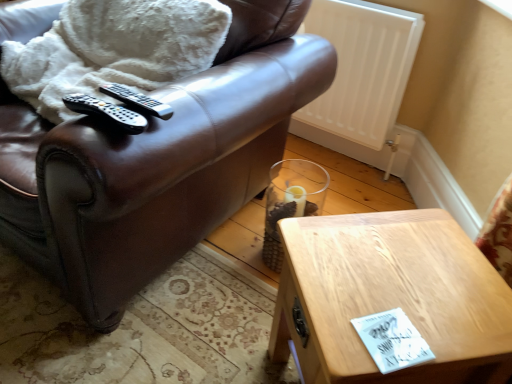
Measure the distance between point [130,263] and camera.

3.49 feet.

The image size is (512, 384). Describe the element at coordinates (291, 201) in the screenshot. I see `clear glass vase at lower center` at that location.

Image resolution: width=512 pixels, height=384 pixels. Describe the element at coordinates (106, 112) in the screenshot. I see `black plastic remote at center, which ranks as the 2th remote in back-to-front order` at that location.

Locate an element on the screen. wooden table at lower right is located at coordinates (390, 297).

Relative to black plastic remote at upper left, the second remote positioned from the front, is brown leather chair at upper left in front or behind?

Visually, brown leather chair at upper left is located in front of black plastic remote at upper left, the second remote positioned from the front.

Is brown leather chair at upper left taller or shorter than black plastic remote at upper left, the second remote positioned from the front?

Clearly, brown leather chair at upper left is taller compared to black plastic remote at upper left, the second remote positioned from the front.

Is point (53, 253) more distant than point (143, 105)?

Yes, it is.

Does white matte radiator at upper right appear on the left side of black plastic remote at upper left, which ranks as the first remote in back-to-front order?

No, white matte radiator at upper right is not to the left of black plastic remote at upper left, which ranks as the first remote in back-to-front order.

Is white matte radiator at upper right far from black plastic remote at upper left, which ranks as the first remote in back-to-front order?

Yes, white matte radiator at upper right and black plastic remote at upper left, which ranks as the first remote in back-to-front order, are located far from each other.

How many degrees apart are the facing directions of white matte radiator at upper right and black plastic remote at upper left, the second remote positioned from the front?

They differ by 4.75 degrees in their facing directions.

Is white matte radiator at upper right positioned beyond the bounds of black plastic remote at upper left, the second remote positioned from the front?

Yes, white matte radiator at upper right is located beyond the bounds of black plastic remote at upper left, the second remote positioned from the front.

Between clear glass vase at lower center and brown leather chair at upper left, which one appears on the right side from the viewer's perspective?

clear glass vase at lower center is more to the right.

Can you confirm if clear glass vase at lower center is thinner than brown leather chair at upper left?

Indeed, clear glass vase at lower center has a lesser width compared to brown leather chair at upper left.

Is clear glass vase at lower center looking in the opposite direction of brown leather chair at upper left?

No, clear glass vase at lower center is not facing the opposite direction of brown leather chair at upper left.

From a real-world perspective, which object stands above the other?

In real-world perspective, brown leather chair at upper left is above.

Considering the relative positions of black plastic remote at center, the first remote in the front-to-back sequence, and wooden table at lower right in the image provided, is black plastic remote at center, the first remote in the front-to-back sequence, to the left or to the right of wooden table at lower right?

black plastic remote at center, the first remote in the front-to-back sequence, is to the left of wooden table at lower right.

Who is bigger, black plastic remote at center, the first remote in the front-to-back sequence, or wooden table at lower right?

wooden table at lower right.

Is black plastic remote at center, the first remote in the front-to-back sequence, next to wooden table at lower right and touching it?

black plastic remote at center, the first remote in the front-to-back sequence, is not next to wooden table at lower right, and they're not touching.

Is black plastic remote at center, which ranks as the 2th remote in back-to-front order, oriented away from wooden table at lower right?

black plastic remote at center, which ranks as the 2th remote in back-to-front order, does not have its back to wooden table at lower right.

Consider the image. From a real-world perspective, between wooden table at lower right and white matte radiator at upper right, who is vertically lower?

wooden table at lower right.

Who is more distant, wooden table at lower right or white matte radiator at upper right?

Positioned behind is white matte radiator at upper right.

Is point (348, 315) closer to camera compared to point (318, 122)?

Yes, point (348, 315) is in front of point (318, 122).

From the image's perspective, between wooden table at lower right and white matte radiator at upper right, who is located below?

wooden table at lower right, from the image's perspective.

Is black plastic remote at upper left, the second remote positioned from the front, positioned far away from wooden table at lower right?

black plastic remote at upper left, the second remote positioned from the front, is near wooden table at lower right, not far away.

From a real-world perspective, is black plastic remote at upper left, the second remote positioned from the front, under wooden table at lower right?

No, from a real-world perspective, black plastic remote at upper left, the second remote positioned from the front, is not beneath wooden table at lower right.

In terms of size, does black plastic remote at upper left, the second remote positioned from the front, appear bigger or smaller than wooden table at lower right?

black plastic remote at upper left, the second remote positioned from the front, is smaller than wooden table at lower right.

Could you tell me if white matte radiator at upper right is facing brown leather chair at upper left?

Yes, white matte radiator at upper right is facing brown leather chair at upper left.

From the image's perspective, is white matte radiator at upper right on brown leather chair at upper left?

Yes, from the image's perspective, white matte radiator at upper right is above brown leather chair at upper left.

Is white matte radiator at upper right positioned in front of brown leather chair at upper left?

No.

Image resolution: width=512 pixels, height=384 pixels. In order to click on chair lying on the left of black plastic remote at upper left, which ranks as the first remote in back-to-front order in this screenshot , I will do `click(156, 164)`.

Locate an element on the screen. radiator below the black plastic remote at upper left, the second remote positioned from the front (from a real-world perspective) is located at coordinates (362, 67).

When comparing their distances from wooden table at lower right, does clear glass vase at lower center or black plastic remote at upper left, the second remote positioned from the front, seem further?

clear glass vase at lower center is positioned further to the anchor wooden table at lower right.

Based on their spatial positions, is white fluffy blanket at upper left or white matte radiator at upper right closer to clear glass vase at lower center?

white matte radiator at upper right is positioned closer to the anchor clear glass vase at lower center.

Based on their spatial positions, is white fluffy blanket at upper left or wooden table at lower right closer to brown leather chair at upper left?

Among the two, white fluffy blanket at upper left is located nearer to brown leather chair at upper left.

Looking at the image, which one is located further to black plastic remote at upper left, which ranks as the first remote in back-to-front order, white fluffy blanket at upper left or brown leather chair at upper left?

Among the two, white fluffy blanket at upper left is located further to black plastic remote at upper left, which ranks as the first remote in back-to-front order.

Estimate the real-world distances between objects in this image. Which object is closer to clear glass vase at lower center, black plastic remote at center, the first remote in the front-to-back sequence, or white matte radiator at upper right?

white matte radiator at upper right lies closer to clear glass vase at lower center than the other object.

From the image, which object appears to be nearer to black plastic remote at upper left, the second remote positioned from the front, black plastic remote at center, which ranks as the 2th remote in back-to-front order, or white fluffy blanket at upper left?

black plastic remote at center, which ranks as the 2th remote in back-to-front order, is positioned closer to the anchor black plastic remote at upper left, the second remote positioned from the front.

From the image, which object appears to be farther from brown leather chair at upper left, white matte radiator at upper right or white fluffy blanket at upper left?

The object further to brown leather chair at upper left is white matte radiator at upper right.

Which object lies nearer to the anchor point white fluffy blanket at upper left, black plastic remote at upper left, the second remote positioned from the front, or white matte radiator at upper right?

Among the two, black plastic remote at upper left, the second remote positioned from the front, is located nearer to white fluffy blanket at upper left.

Locate an element on the screen. The width and height of the screenshot is (512, 384). blanket between white matte radiator at upper right and wooden table at lower right vertically is located at coordinates (114, 49).

The height and width of the screenshot is (384, 512). Find the location of `remote positioned between black plastic remote at center, which ranks as the 2th remote in back-to-front order, and clear glass vase at lower center from near to far`. remote positioned between black plastic remote at center, which ranks as the 2th remote in back-to-front order, and clear glass vase at lower center from near to far is located at coordinates (137, 100).

Image resolution: width=512 pixels, height=384 pixels. I want to click on remote between white fluffy blanket at upper left and black plastic remote at center, the first remote in the front-to-back sequence, in the vertical direction, so click(137, 100).

Where is `chair between white fluffy blanket at upper left and wooden table at lower right from top to bottom`? chair between white fluffy blanket at upper left and wooden table at lower right from top to bottom is located at coordinates (156, 164).